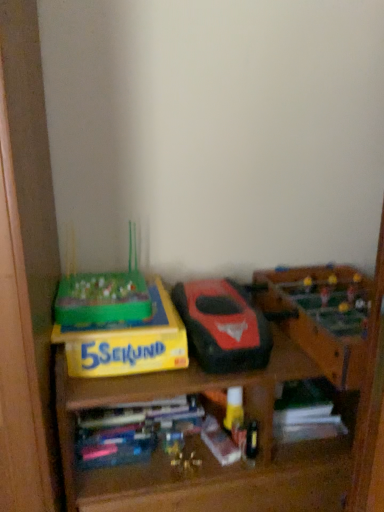
Question: Is wooden foosball table at right, arranged as the first toy when viewed from the right, thinner than matte black toy car at center, arranged as the second toy when viewed from the right?

Choices:
 (A) yes
 (B) no

Answer: (B)

Question: Does wooden foosball table at right, which is the 2th toy in left-to-right order, appear on the left side of matte black toy car at center, which ranks as the first toy in left-to-right order?

Choices:
 (A) no
 (B) yes

Answer: (A)

Question: Is the position of wooden foosball table at right, arranged as the first toy when viewed from the right, more distant than that of matte black toy car at center, which ranks as the first toy in left-to-right order?

Choices:
 (A) yes
 (B) no

Answer: (B)

Question: Is wooden foosball table at right, arranged as the first toy when viewed from the right, oriented away from matte black toy car at center, which ranks as the first toy in left-to-right order?

Choices:
 (A) no
 (B) yes

Answer: (A)

Question: Is wooden foosball table at right, which is the 2th toy in left-to-right order, not close to matte black toy car at center, arranged as the second toy when viewed from the right?

Choices:
 (A) no
 (B) yes

Answer: (A)

Question: From a real-world perspective, is wooden foosball table at right, which is the 2th toy in left-to-right order, physically above matte black toy car at center, arranged as the second toy when viewed from the right?

Choices:
 (A) yes
 (B) no

Answer: (B)

Question: Is the depth of matte black toy car at center, arranged as the second toy when viewed from the right, greater than that of white matte book at lower right, acting as the 1th book starting from the right?

Choices:
 (A) no
 (B) yes

Answer: (A)

Question: Can you confirm if matte black toy car at center, which ranks as the first toy in left-to-right order, is bigger than white matte book at lower right, marked as the 2th book in a left-to-right arrangement?

Choices:
 (A) no
 (B) yes

Answer: (B)

Question: Does matte black toy car at center, which ranks as the first toy in left-to-right order, turn towards white matte book at lower right, marked as the 2th book in a left-to-right arrangement?

Choices:
 (A) no
 (B) yes

Answer: (A)

Question: Is white matte book at lower right, marked as the 2th book in a left-to-right arrangement, completely or partially inside matte black toy car at center, arranged as the second toy when viewed from the right?

Choices:
 (A) no
 (B) yes

Answer: (A)

Question: From a real-world perspective, does matte black toy car at center, which ranks as the first toy in left-to-right order, sit lower than white matte book at lower right, acting as the 1th book starting from the right?

Choices:
 (A) yes
 (B) no

Answer: (B)

Question: Is matte black toy car at center, which ranks as the first toy in left-to-right order, far away from white matte book at lower right, marked as the 2th book in a left-to-right arrangement?

Choices:
 (A) no
 (B) yes

Answer: (A)

Question: Does multicolored plastic books at center, acting as the 1th book starting from the left, touch yellow cardboard box at left?

Choices:
 (A) no
 (B) yes

Answer: (A)